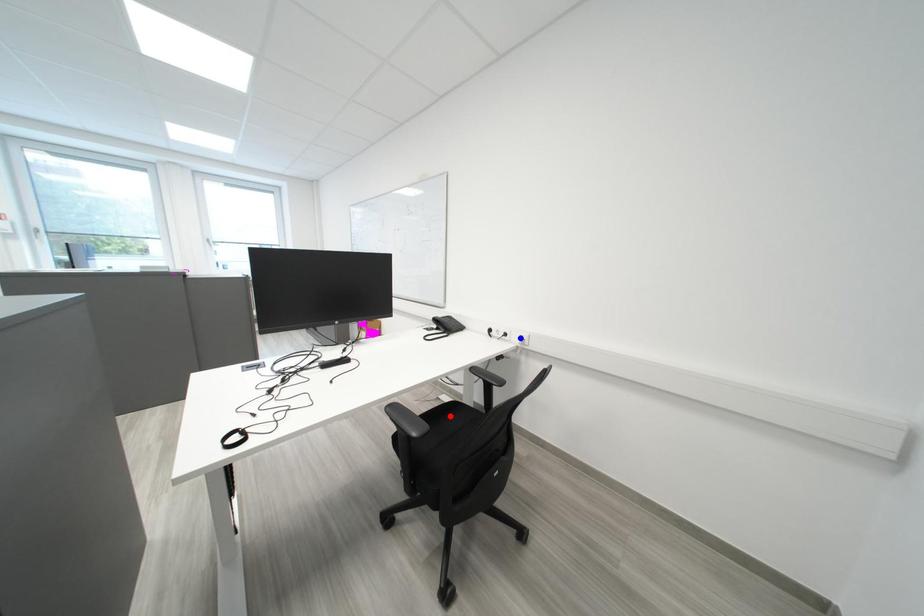
Question: Two points are marked on the image. Which point is closer to the camera?

Choices:
 (A) Blue point is closer.
 (B) Red point is closer.

Answer: (A)